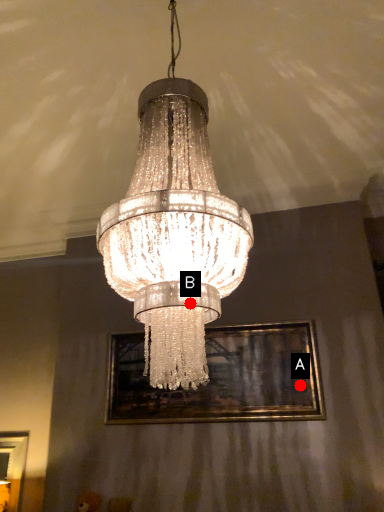
Question: Two points are circled on the image, labeled by A and B beside each circle. Which point is further to the camera?

Choices:
 (A) A is further
 (B) B is further

Answer: (A)